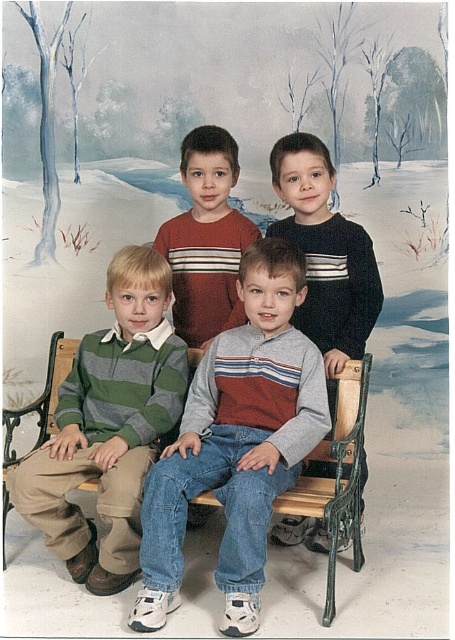
Does striped knit sweater at center have a smaller size compared to green striped sweater at left?

No.

Between striped knit sweater at center and green striped sweater at left, which one appears on the left side from the viewer's perspective?

Positioned to the left is green striped sweater at left.

Locate an element on the screen. The image size is (455, 640). striped knit sweater at center is located at coordinates (x=237, y=442).

Which is behind, point (220, 148) or point (347, 456)?

Positioned behind is point (220, 148).

Is striped sweater at center shorter than wooden bench at center?

In fact, striped sweater at center may be taller than wooden bench at center.

You are a GUI agent. You are given a task and a screenshot of the screen. Output one action in this format:
    pyautogui.click(x=<x>, y=<y>)
    Task: Click on the striped sweater at center
    The height and width of the screenshot is (640, 455).
    Given the screenshot: What is the action you would take?
    click(206, 237)

Between point (252, 620) and point (365, 371), which one is positioned in front?

Point (252, 620) is in front.

Is point (276, 280) closer to viewer compared to point (3, 472)?

Yes, point (276, 280) is in front of point (3, 472).

Locate an element on the screen. The width and height of the screenshot is (455, 640). striped knit sweater at center is located at coordinates (237, 442).